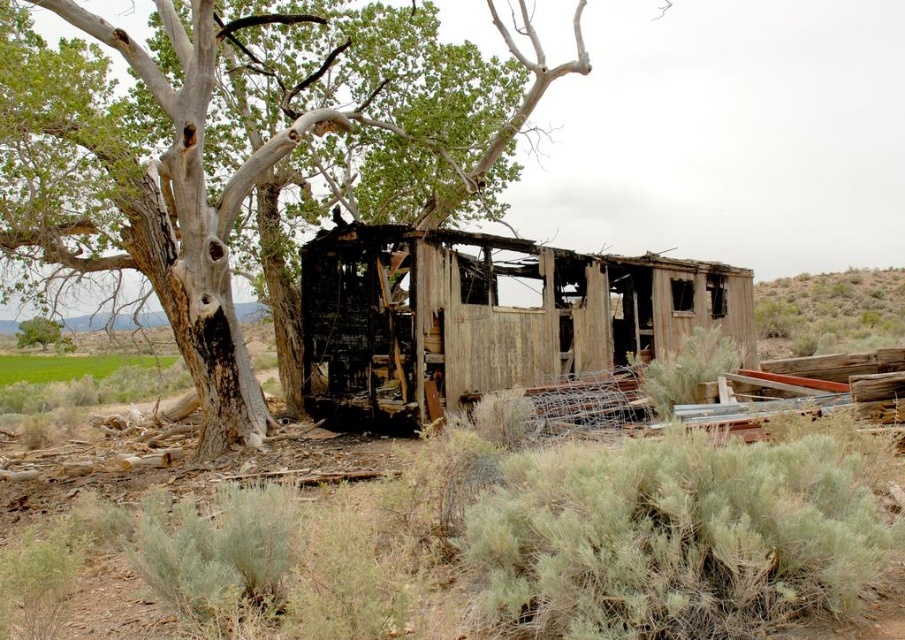
You are a hiker lost in the desert and need to determine which plant to use for shade. You see a gray bark tree at center and a green shrubbery at right. Which one has a thicker trunk or branches to provide better shade?

The green shrubbery at right is thicker than the gray bark tree at center, so it would provide better shade due to its thicker branches and foliage.

You are a hiker who needs to cross the area between the weathered wood hut at center and the green shrubbery at right. Given that the distance between them is 10 meters, and your backpack is 1.5 meters wide, can you safely pass through the space between them without touching either?

The weathered wood hut at center has a lesser width compared to green shrubbery at right. Since the distance between them is 10 meters and your backpack is only 1.5 meters wide, you can safely pass through the space between them without touching either.

You are a hiker lost in the desert and see the weathered wood hut at center and the green shrubbery at right. Which direction should you head to find the nearest water source, considering the shrubbery typically grows near water?

The green shrubbery at right is to the right of the weathered wood hut at center. Since shrubs often grow near water sources, you should head towards the green shrubbery at right to find water.